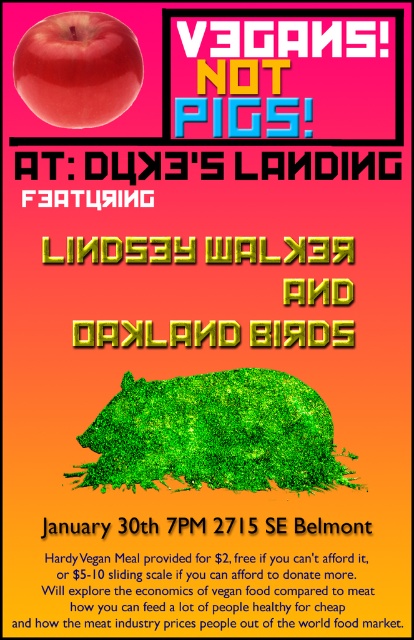
Can you confirm if white paper at upper center is positioned to the right of shiny red apple at upper left?

Correct, you'll find white paper at upper center to the right of shiny red apple at upper left.

Is point (310, 600) less distant than point (94, 76)?

Yes, point (310, 600) is closer to viewer.

Locate an element on the screen. white paper at upper center is located at coordinates (209, 577).

Who is taller, yellow metallic lindsey walker and oakland birds at center or shiny red apple at upper left?

With more height is yellow metallic lindsey walker and oakland birds at center.

Which is below, yellow metallic lindsey walker and oakland birds at center or shiny red apple at upper left?

Positioned lower is yellow metallic lindsey walker and oakland birds at center.

Who is more distant from viewer, [115,346] or [62,83]?

Positioned behind is point [115,346].

This screenshot has height=640, width=414. I want to click on yellow metallic lindsey walker and oakland birds at center, so click(x=154, y=332).

Who is lower down, white paper at upper center or yellow metallic lindsey walker and oakland birds at center?

Positioned lower is white paper at upper center.

Is white paper at upper center taller than yellow metallic lindsey walker and oakland birds at center?

Incorrect, white paper at upper center's height is not larger of yellow metallic lindsey walker and oakland birds at center's.

Which is in front, point (358, 634) or point (88, 333)?

Positioned in front is point (358, 634).

Locate an element on the screen. white paper at upper center is located at coordinates (209, 577).